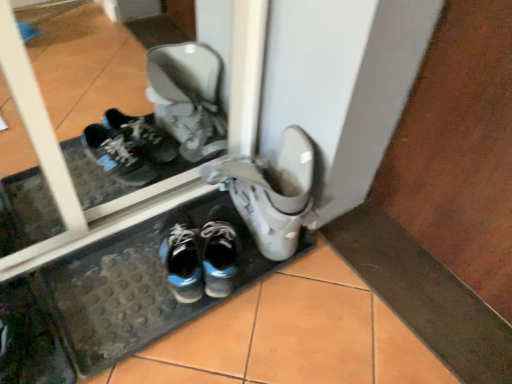
This screenshot has height=384, width=512. Find the location of `vacant space in front of shiny blue running shoe at center`. vacant space in front of shiny blue running shoe at center is located at coordinates (144, 315).